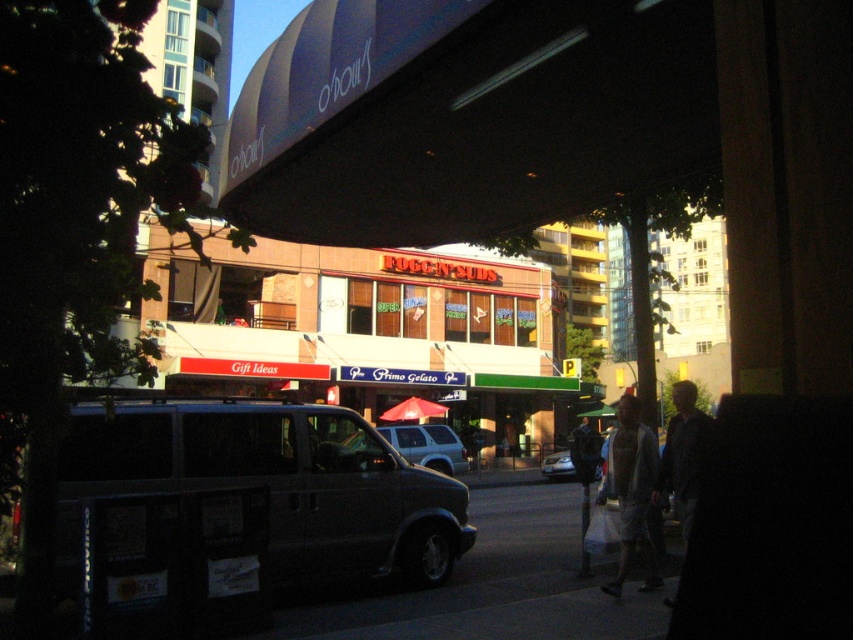
Question: Can you confirm if light gray cotton t-shirt at lower right is smaller than silver metallic suv at center?

Choices:
 (A) no
 (B) yes

Answer: (B)

Question: Does dark gray jacket at lower right appear on the right side of silver metallic suv at center?

Choices:
 (A) yes
 (B) no

Answer: (A)

Question: Which object is positioned closest to the matte red building at center?

Choices:
 (A) red fabric umbrella at center
 (B) silver metallic suv at center

Answer: (A)

Question: Which point is farther to the camera?

Choices:
 (A) (664, 442)
 (B) (585, 550)

Answer: (B)

Question: Which point is farther to the camera?

Choices:
 (A) dark gray jacket at lower right
 (B) silver metallic suv at center

Answer: (B)

Question: Is silver metallic suv at center above dark gray pants at center?

Choices:
 (A) no
 (B) yes

Answer: (B)